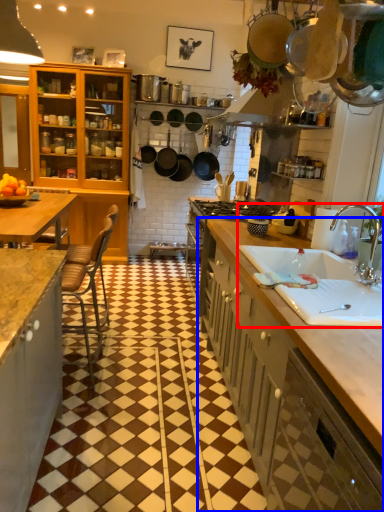
Question: Which object appears closest to the camera in this image, sink (highlighted by a red box) or cabinetry (highlighted by a blue box)?

Choices:
 (A) sink
 (B) cabinetry

Answer: (A)